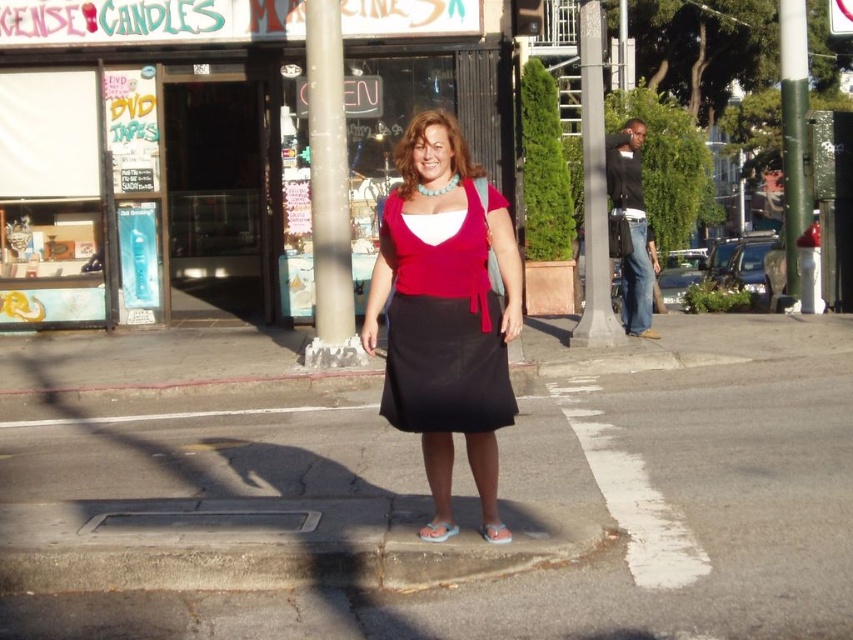
You are a delivery person who needs to place a package on the ground. You see the black asphalt at center and the matte red dress at center. Which one is lower to the ground?

The black asphalt at center is below the matte red dress at center, so it is lower to the ground.

You are a delivery person who needs to place a package on the black asphalt at center. Your delivery vehicle is parked 4 meters away from the package drop zone. Can you reach the drop zone without moving the vehicle?

The black asphalt at center is 3.79 meters away, so yes, you can reach the drop zone without moving the vehicle since the distance is less than 4 meters.